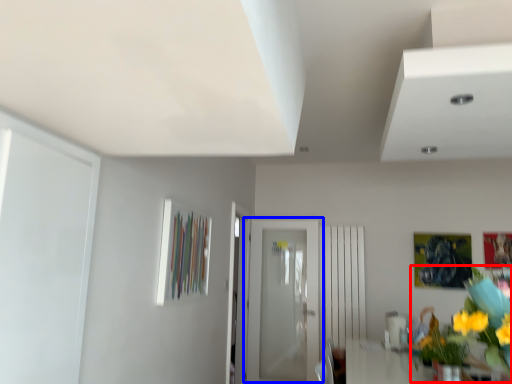
Question: Which point is further to the camera, floral arrangement (highlighted by a red box) or door (highlighted by a blue box)?

Choices:
 (A) floral arrangement
 (B) door

Answer: (B)